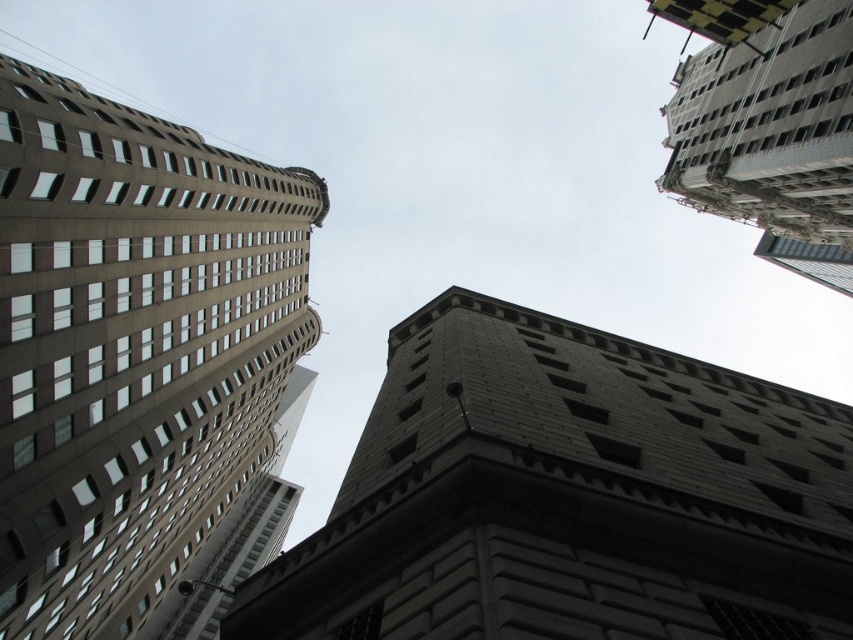
Question: Considering the relative positions of brown concrete building at left and gray concrete building at upper right in the image provided, where is brown concrete building at left located with respect to gray concrete building at upper right?

Choices:
 (A) below
 (B) above

Answer: (A)

Question: Which object is positioned closest to the gray stone tower at center?

Choices:
 (A) brown concrete building at left
 (B) gray concrete building at upper right

Answer: (A)

Question: Is gray stone tower at center wider than brown concrete building at left?

Choices:
 (A) no
 (B) yes

Answer: (B)

Question: Based on their relative distances, which object is farther from the gray concrete building at upper right?

Choices:
 (A) gray stone tower at center
 (B) brown concrete building at left

Answer: (B)

Question: In this image, where is gray stone tower at center located relative to gray concrete building at upper right?

Choices:
 (A) right
 (B) left

Answer: (B)

Question: Among these points, which one is farthest from the camera?

Choices:
 (A) (248, 456)
 (B) (640, 397)
 (C) (840, 99)

Answer: (A)